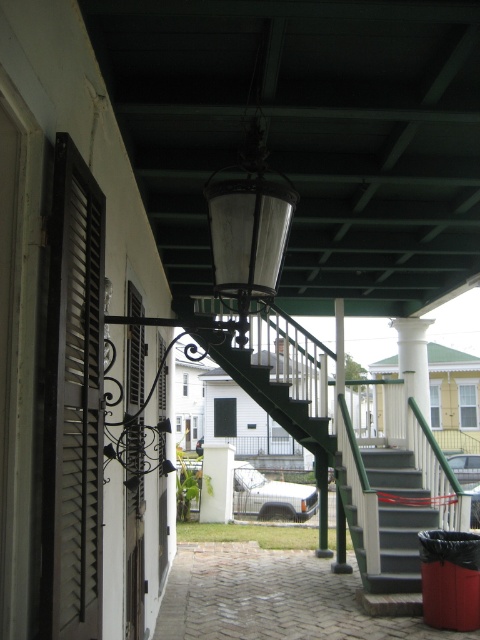
Question: Is black matte shutters at left positioned before dark gray concrete stairs at center?

Choices:
 (A) no
 (B) yes

Answer: (B)

Question: Is black matte shutters at left above dark gray concrete stairs at center?

Choices:
 (A) no
 (B) yes

Answer: (B)

Question: Does black matte shutters at left appear over white painted wood shutter at left?

Choices:
 (A) yes
 (B) no

Answer: (A)

Question: Which of the following is the farthest from the observer?

Choices:
 (A) dark gray concrete stairs at center
 (B) black matte shutters at left
 (C) white painted wood shutter at left

Answer: (A)

Question: Which point is farther to the camera?

Choices:
 (A) white painted wood shutter at left
 (B) dark gray concrete stairs at center

Answer: (B)

Question: Which of the following is the closest to the observer?

Choices:
 (A) dark gray concrete stairs at center
 (B) black matte shutters at left
 (C) white painted wood shutter at left

Answer: (B)